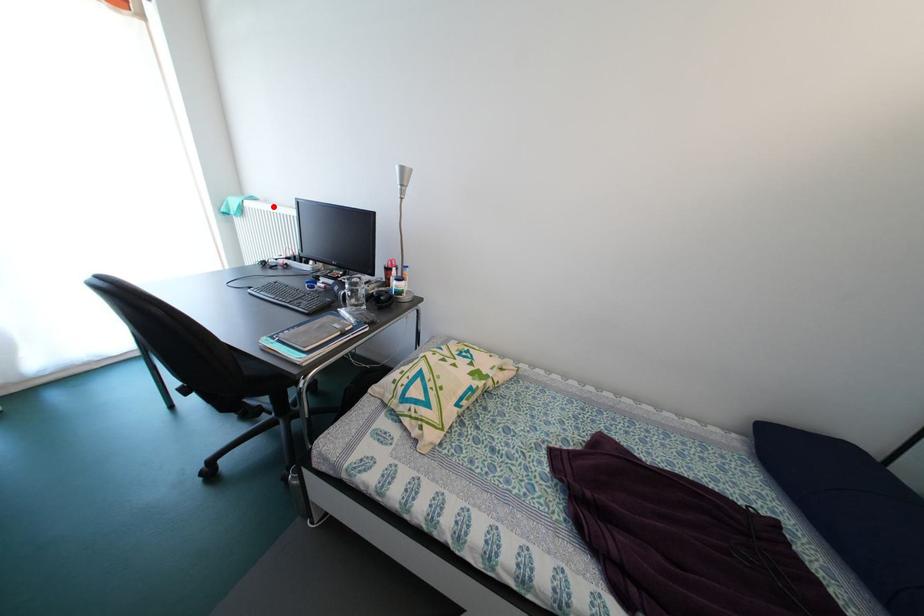
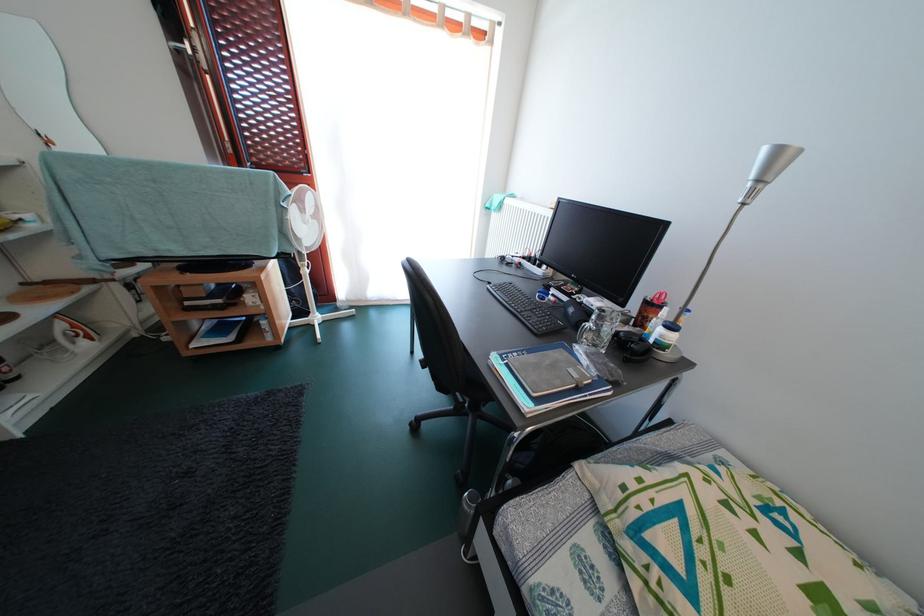
Locate, in the second image, the point that corresponds to the highlighted location in the first image.

(529, 204)